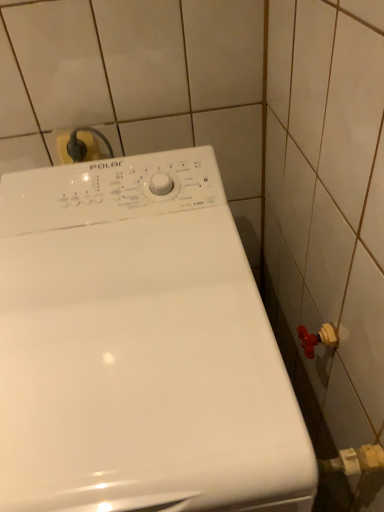
Question: Choose the correct answer: Is white glossy washing machine at center inside yellow plastic plug at upper left or outside it?

Choices:
 (A) inside
 (B) outside

Answer: (B)

Question: Looking at the image, does white glossy washing machine at center seem bigger or smaller compared to yellow plastic plug at upper left?

Choices:
 (A) small
 (B) big

Answer: (B)

Question: From the image's perspective, is white glossy washing machine at center positioned above or below yellow plastic plug at upper left?

Choices:
 (A) above
 (B) below

Answer: (B)

Question: From the image's perspective, is yellow plastic plug at upper left positioned above or below white glossy washing machine at center?

Choices:
 (A) below
 (B) above

Answer: (B)

Question: Based on their positions, is yellow plastic plug at upper left located to the left or right of white glossy washing machine at center?

Choices:
 (A) right
 (B) left

Answer: (B)

Question: Which is correct: yellow plastic plug at upper left is inside white glossy washing machine at center, or outside of it?

Choices:
 (A) inside
 (B) outside

Answer: (B)

Question: Looking at their shapes, would you say yellow plastic plug at upper left is wider or thinner than white glossy washing machine at center?

Choices:
 (A) thin
 (B) wide

Answer: (A)